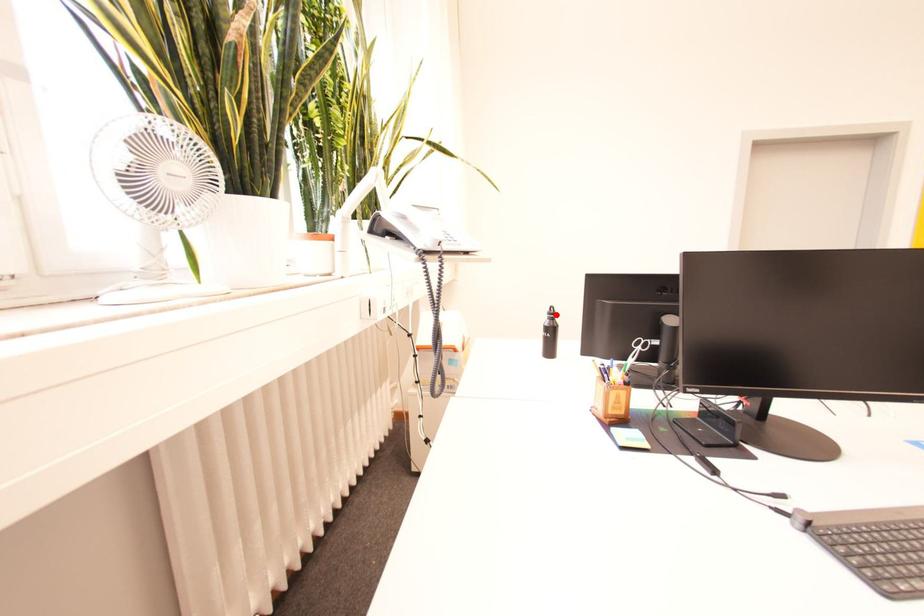
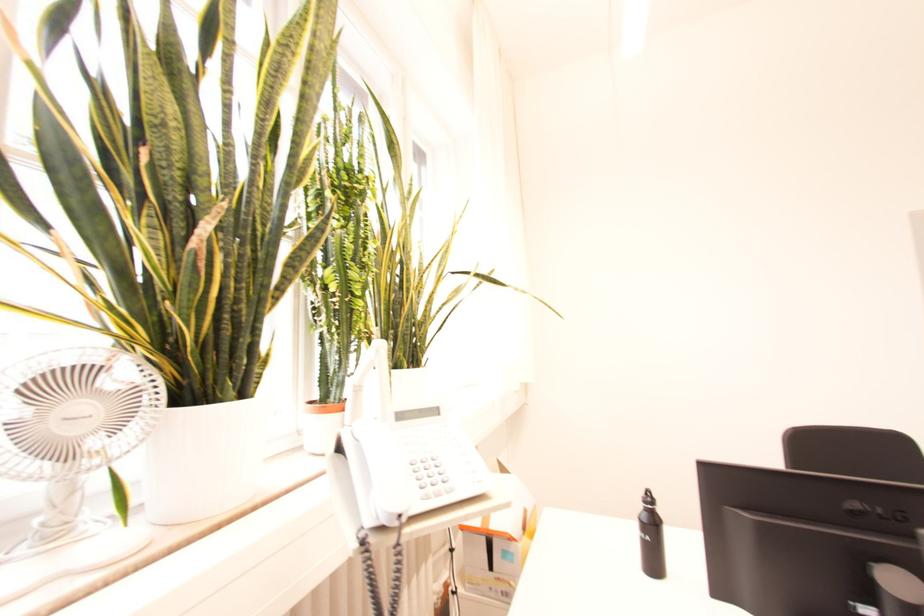
Where in the second image is the point corresponding to the highlighted location from the first image?

(651, 503)